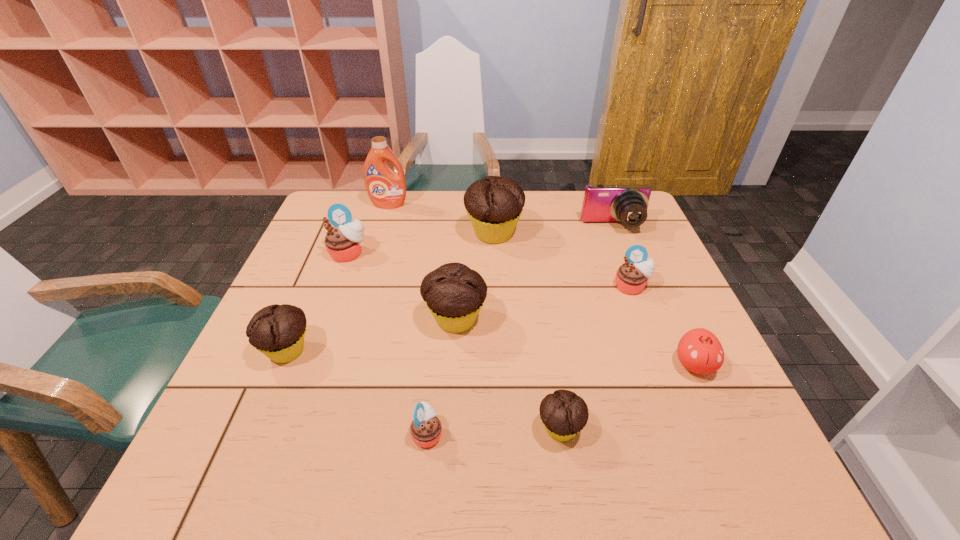
The image size is (960, 540). What are the coordinates of `apple that is at the right edge` in the screenshot? It's located at (699, 350).

Identify the location of object located at the far left corner. (x=386, y=188).

You are a GUI agent. You are given a task and a screenshot of the screen. Output one action in this format:
    pyautogui.click(x=<x>, y=<y>)
    Task: Click on the object located at the far right corner
    This screenshot has width=960, height=540.
    Given the screenshot: What is the action you would take?
    pyautogui.click(x=628, y=204)

The height and width of the screenshot is (540, 960). What are the coordinates of `vacant area at the far edge` in the screenshot? It's located at (x=438, y=197).

This screenshot has width=960, height=540. What are the coordinates of `vacant region at the near edge of the desktop` in the screenshot? It's located at (674, 485).

Image resolution: width=960 pixels, height=540 pixels. In order to click on vacant region at the left edge in this screenshot , I will do `click(227, 409)`.

You are a GUI agent. You are given a task and a screenshot of the screen. Output one action in this format:
    pyautogui.click(x=<x>, y=<y>)
    Task: Click on the free space at the right edge of the desktop
    The image size is (960, 540).
    Given the screenshot: What is the action you would take?
    pyautogui.click(x=697, y=404)

Where is `vacant space at the far left corner`? This screenshot has height=540, width=960. vacant space at the far left corner is located at coordinates (357, 217).

Where is `vacant space at the near left corner of the desktop`? This screenshot has height=540, width=960. vacant space at the near left corner of the desktop is located at coordinates (227, 456).

The image size is (960, 540). In order to click on free point between the leftmost pink muffin and the nearest pink muffin in this screenshot , I will do `click(388, 343)`.